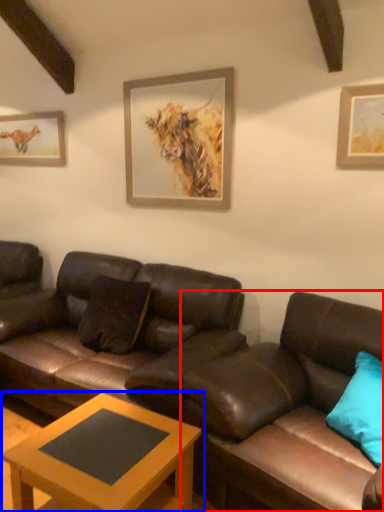
Question: Which object is further to the camera taking this photo, studio couch (highlighted by a red box) or coffee table (highlighted by a blue box)?

Choices:
 (A) studio couch
 (B) coffee table

Answer: (B)